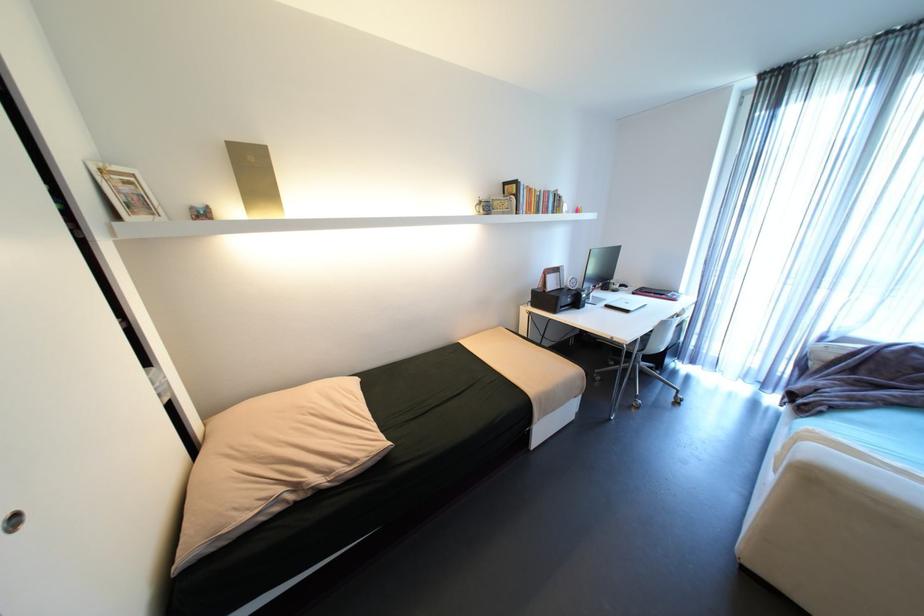
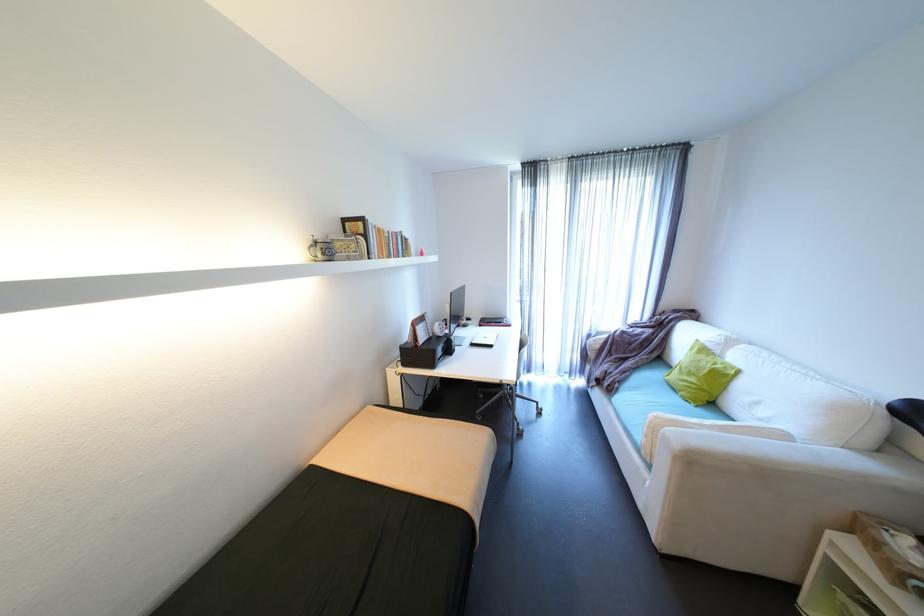
The point at (528, 211) is marked in the first image. Where is the corresponding point in the second image?

(380, 254)